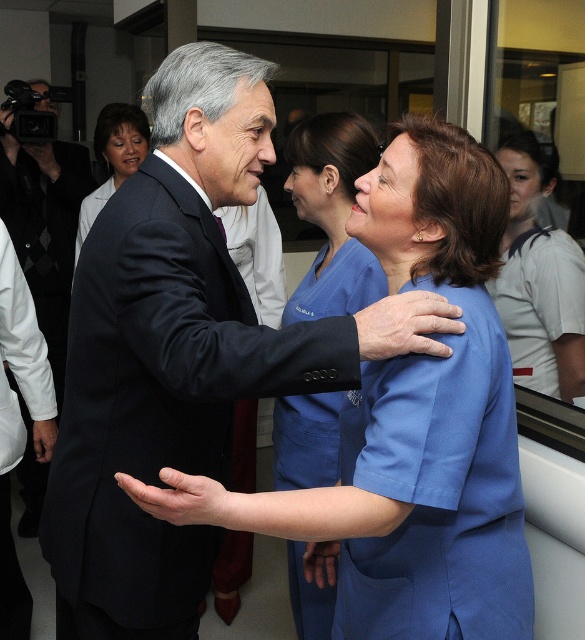
Question: Which object appears closest to the camera in this image?

Choices:
 (A) black wool suit at center
 (B) matte black suit at upper left
 (C) blue scrubs at center

Answer: (A)

Question: Can you confirm if black wool suit at center is wider than leather-like hand at center?

Choices:
 (A) no
 (B) yes

Answer: (B)

Question: Among these points, which one is nearest to the camera?

Choices:
 (A) (143, 506)
 (B) (139, 157)

Answer: (A)

Question: Is blue scrubs at center thinner than matte black suit at upper left?

Choices:
 (A) no
 (B) yes

Answer: (B)

Question: Is blue scrubs at center below leather-like hand at center?

Choices:
 (A) yes
 (B) no

Answer: (A)

Question: Which of these objects is positioned farthest from the dark suit at left?

Choices:
 (A) blue scrubs at center
 (B) black wool suit at center
 (C) black leather hand at center

Answer: (B)